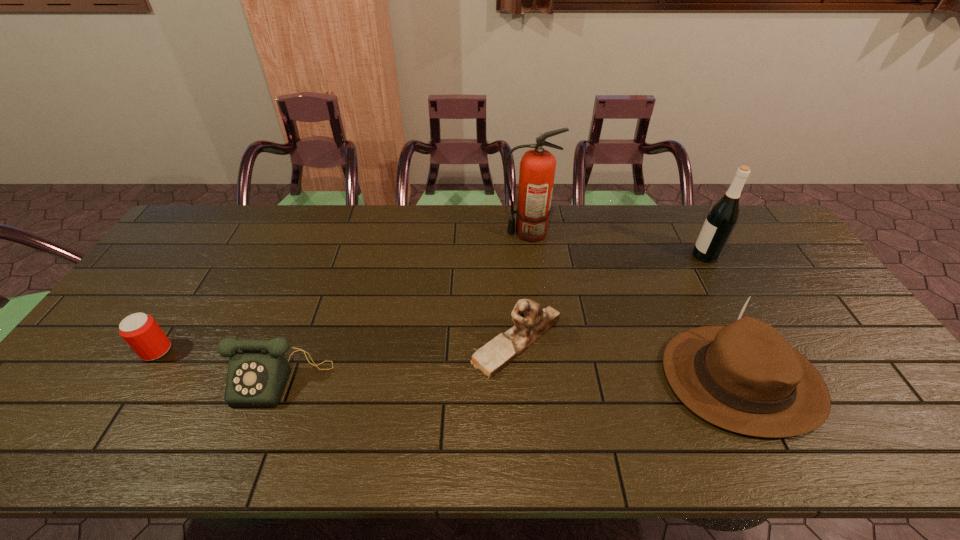
Find the location of a particular element. This screenshot has height=540, width=960. vacant region located 0.110m on the dial of the fifth object from right to left is located at coordinates (252, 454).

The height and width of the screenshot is (540, 960). What are the coordinates of `vacant area situated 0.080m on the back of the leftmost object` in the screenshot? It's located at click(x=179, y=316).

Locate an element on the screen. fire extinguisher located at the far edge is located at coordinates (537, 167).

The width and height of the screenshot is (960, 540). I want to click on wine bottle located at the far edge, so click(x=721, y=220).

Find the location of `object that is at the near edge`. object that is at the near edge is located at coordinates (745, 377).

This screenshot has height=540, width=960. Identify the location of object at the left edge. (141, 332).

In order to click on vacant space at the far edge in this screenshot , I will do `click(266, 223)`.

Identify the location of vacant space at the near edge. This screenshot has height=540, width=960. (158, 423).

The image size is (960, 540). In order to click on free spot at the left edge of the desktop in this screenshot , I will do `click(75, 374)`.

Locate an element on the screen. This screenshot has width=960, height=540. vacant space at the right edge is located at coordinates (826, 307).